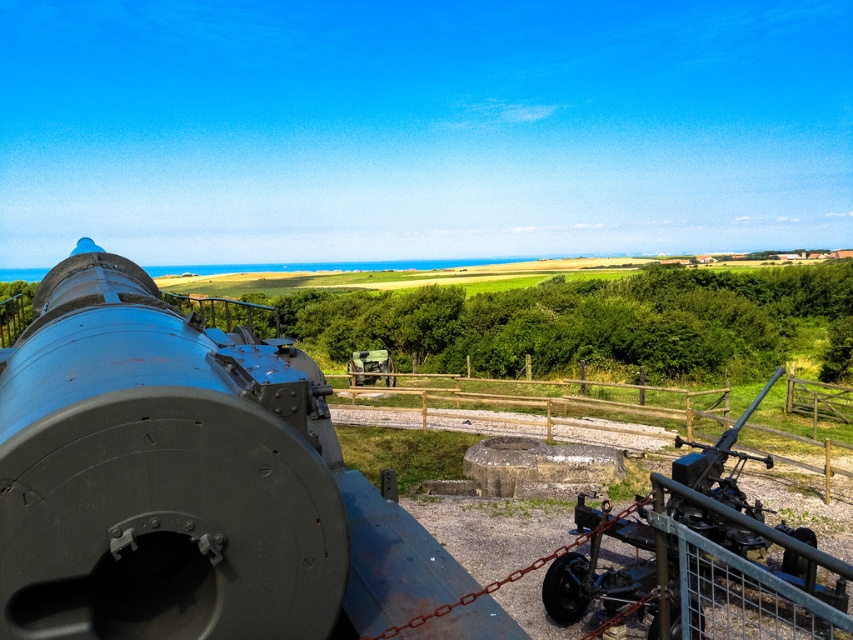
Does matte black cannon at left have a greater height compared to matte black cannon at right?

Correct, matte black cannon at left is much taller as matte black cannon at right.

Is matte black cannon at left positioned before matte black cannon at right?

Yes, it is in front of matte black cannon at right.

Does point (51, 556) come behind point (735, 492)?

No, (51, 556) is closer to viewer.

Identify the location of matte black cannon at left. pos(184,481).